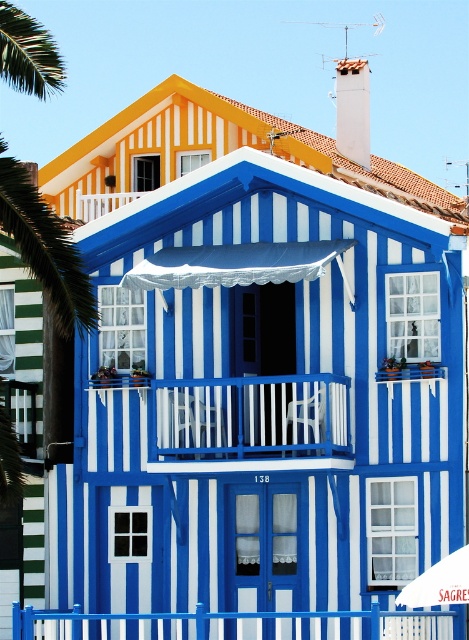
You are standing at a certain distance from the blue striped house at center. If you want to take a photo of it from a distance of 50 meters, should you move closer or farther away?

The blue striped house at center is currently 54.84 meters away from you. To take a photo from 50 meters away, you need to move closer by approximately 4.84 meters.

You are a delivery person standing at the entrance of the building. You need to place a large package between the white plastic chair at center and the white fabric umbrella at center. Can you estimate if the space between them is sufficient to place the package without moving either object?

The distance between the white plastic chair at center and the white fabric umbrella at center is 37.11 feet, so there is enough space to place the package between them without moving either object.